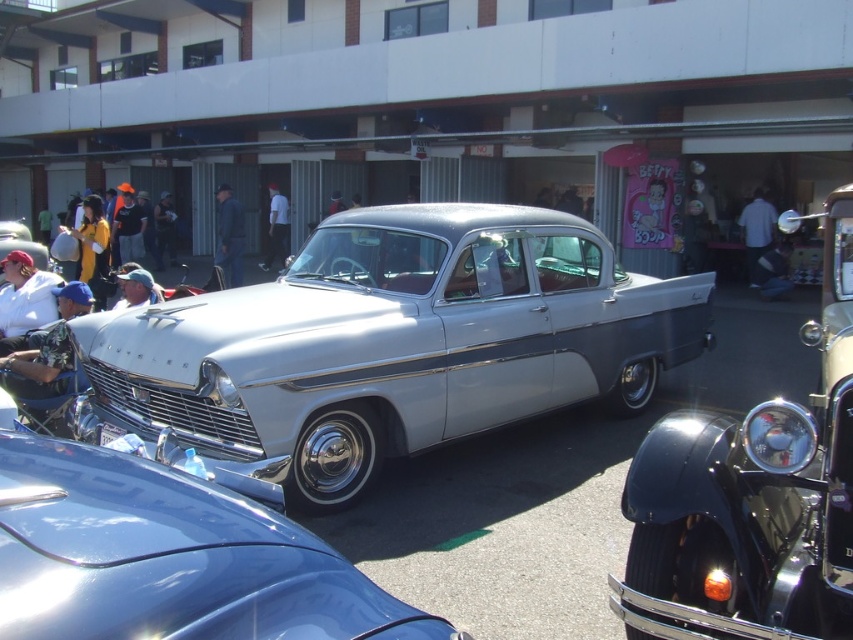
Question: Does silver metallic car at center appear on the right side of white fabric shirt at center?

Choices:
 (A) yes
 (B) no

Answer: (B)

Question: Can you confirm if silver metallic car at center is bigger than white fabric shirt at center?

Choices:
 (A) yes
 (B) no

Answer: (A)

Question: Does silver metallic car at center have a larger size compared to blue denim jacket at center?

Choices:
 (A) no
 (B) yes

Answer: (A)

Question: Which object appears closest to the camera in this image?

Choices:
 (A) white fabric shirt at center
 (B) white cotton shirt at center
 (C) blue denim jacket at center

Answer: (C)

Question: Which object is positioned farthest from the denim jacket at center?

Choices:
 (A) silver metallic pickup truck at center
 (B) silver metallic car at center
 (C) matte silver pickup truck at center
 (D) white cotton shirt at left

Answer: (A)

Question: Which of these objects is positioned farthest from the silver metallic pickup truck at center?

Choices:
 (A) silver metallic car at center
 (B) matte silver pickup truck at center

Answer: (B)